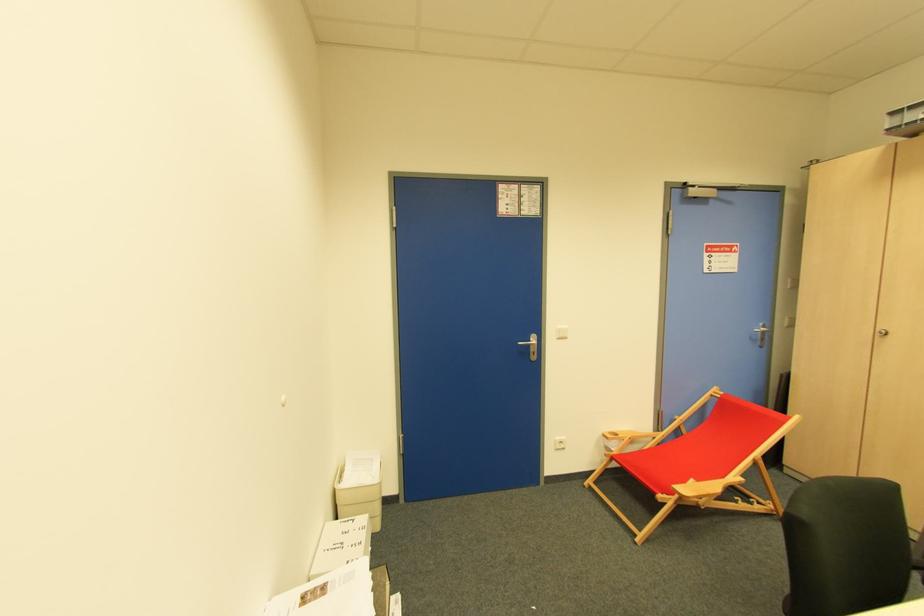
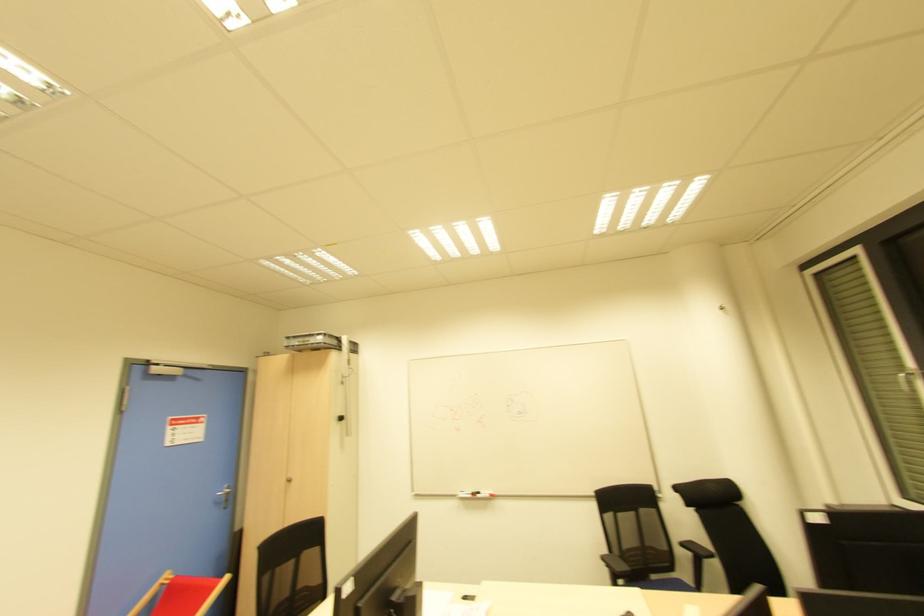
First-person continuous shooting, in which direction is the camera rotating?

The rotation direction of the camera is right-up.